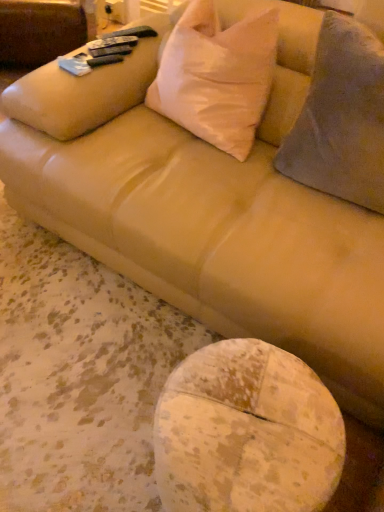
Question: Considering the relative sizes of gray fuzzy throw pillow at right, acting as the second throw pillow starting from the left, and white matte pillow at upper center, the 2th throw pillow in the right-to-left sequence, in the image provided, is gray fuzzy throw pillow at right, acting as the second throw pillow starting from the left, bigger than white matte pillow at upper center, the 2th throw pillow in the right-to-left sequence,?

Choices:
 (A) no
 (B) yes

Answer: (B)

Question: Is gray fuzzy throw pillow at right, positioned as the first throw pillow in right-to-left order, thinner than white matte pillow at upper center, the first throw pillow from the left?

Choices:
 (A) no
 (B) yes

Answer: (A)

Question: Can you confirm if gray fuzzy throw pillow at right, positioned as the first throw pillow in right-to-left order, is shorter than white matte pillow at upper center, the first throw pillow from the left?

Choices:
 (A) no
 (B) yes

Answer: (A)

Question: Is white matte pillow at upper center, the first throw pillow from the left, inside gray fuzzy throw pillow at right, acting as the second throw pillow starting from the left?

Choices:
 (A) no
 (B) yes

Answer: (A)

Question: Is gray fuzzy throw pillow at right, positioned as the first throw pillow in right-to-left order, outside of white matte pillow at upper center, the 2th throw pillow in the right-to-left sequence?

Choices:
 (A) no
 (B) yes

Answer: (B)

Question: Is gray fuzzy throw pillow at right, acting as the second throw pillow starting from the left, bigger or smaller than white matte pillow at upper center, the first throw pillow from the left?

Choices:
 (A) big
 (B) small

Answer: (A)

Question: From a real-world perspective, is gray fuzzy throw pillow at right, acting as the second throw pillow starting from the left, positioned above or below white matte pillow at upper center, the first throw pillow from the left?

Choices:
 (A) above
 (B) below

Answer: (A)

Question: In terms of width, does gray fuzzy throw pillow at right, positioned as the first throw pillow in right-to-left order, look wider or thinner when compared to white matte pillow at upper center, the 2th throw pillow in the right-to-left sequence?

Choices:
 (A) thin
 (B) wide

Answer: (B)

Question: Considering the positions of point (299, 181) and point (182, 74), is point (299, 181) closer or farther from the camera than point (182, 74)?

Choices:
 (A) closer
 (B) farther

Answer: (A)

Question: Is point (223, 83) positioned closer to the camera than point (365, 113)?

Choices:
 (A) farther
 (B) closer

Answer: (A)

Question: From a real-world perspective, relative to gray fuzzy throw pillow at right, positioned as the first throw pillow in right-to-left order, is white matte pillow at upper center, the first throw pillow from the left, vertically above or below?

Choices:
 (A) below
 (B) above

Answer: (A)

Question: Based on their positions, is white matte pillow at upper center, the first throw pillow from the left, located to the left or right of gray fuzzy throw pillow at right, acting as the second throw pillow starting from the left?

Choices:
 (A) right
 (B) left

Answer: (B)

Question: In terms of width, does white matte pillow at upper center, the first throw pillow from the left, look wider or thinner when compared to gray fuzzy throw pillow at right, positioned as the first throw pillow in right-to-left order?

Choices:
 (A) thin
 (B) wide

Answer: (A)

Question: Considering the positions of point (203, 440) and point (337, 37), is point (203, 440) closer or farther from the camera than point (337, 37)?

Choices:
 (A) farther
 (B) closer

Answer: (B)

Question: From a real-world perspective, is speckled wood table at lower center physically located above or below gray fuzzy throw pillow at right, acting as the second throw pillow starting from the left?

Choices:
 (A) above
 (B) below

Answer: (B)